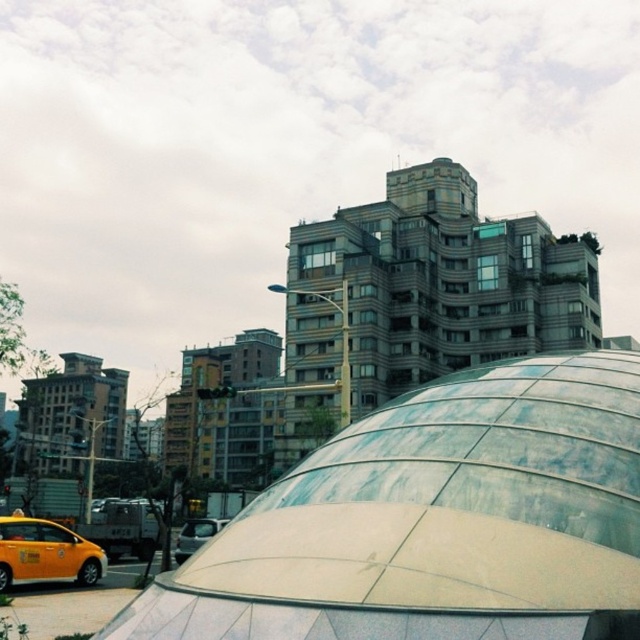
You are a delivery driver approaching the transparent glass dome at center and the silver metallic van at center. Which object should you avoid hitting by steering to the left?

You should avoid hitting the silver metallic van at center by steering to the left since the transparent glass dome at center is to the right of the silver metallic van at center.

You are standing in the urban scene and want to locate the transparent glass dome at center. According to the coordinates provided, where would you look to find it?

The transparent glass dome at center is located at coordinates point (x=436, y=520).

You are a delivery person trying to park your yellow matte taxi at lower left near the transparent glass dome at center. Is there enough space between them to open the trunk of your taxi?

The transparent glass dome at center is positioned over yellow matte taxi at lower left, meaning there is no space between them. Therefore, you cannot open the trunk of your yellow matte taxi at lower left.